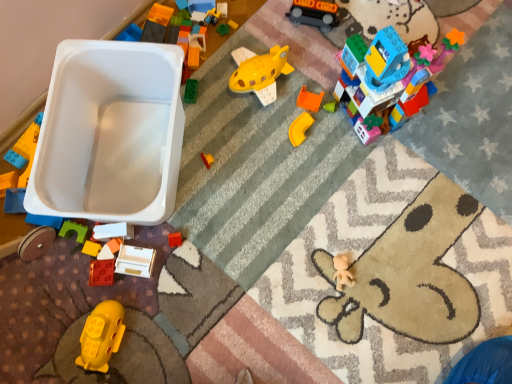
This screenshot has height=384, width=512. In order to click on vacant area that is in front of yellow matte plastic corner piece at center-right, acting as the sixth toy starting from the bottom in this screenshot , I will do `click(303, 189)`.